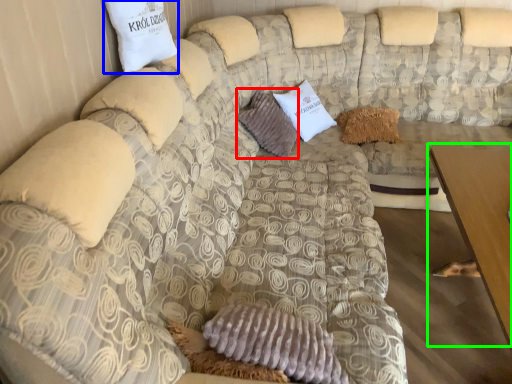
Question: Estimate the real-world distances between objects in this image. Which object is closer to pillow (highlighted by a red box), pillow (highlighted by a blue box) or table (highlighted by a green box)?

Choices:
 (A) pillow
 (B) table

Answer: (A)